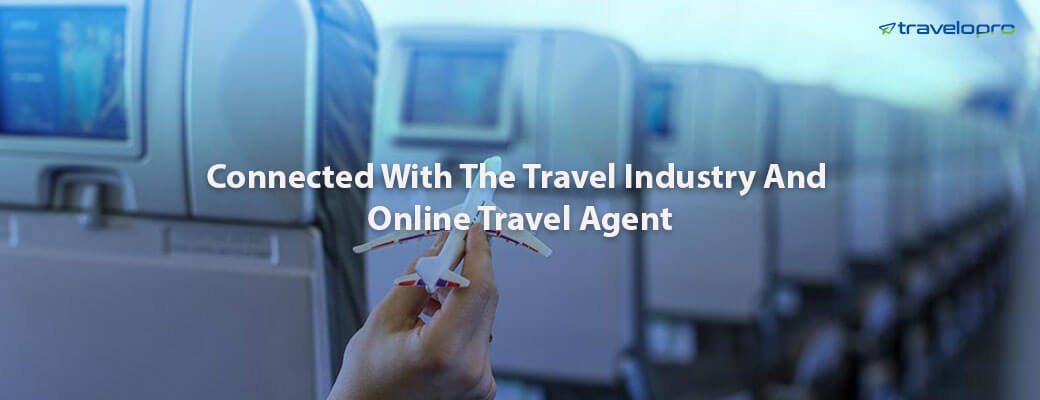
Where is `trim around screen`? trim around screen is located at coordinates (139, 135).